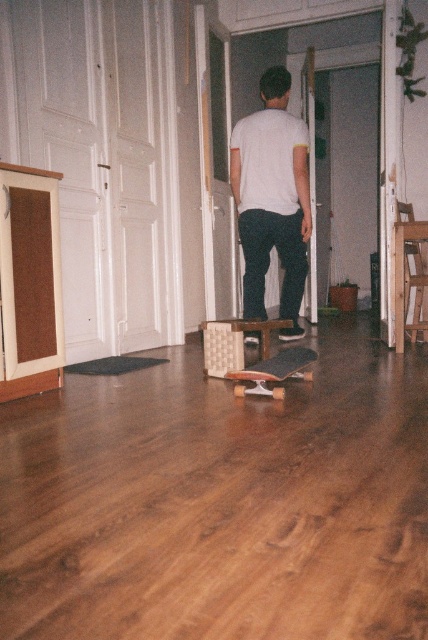
Question: Observing the image, what is the correct spatial positioning of white matte shirt at upper center in reference to wooden skateboard at center?

Choices:
 (A) left
 (B) right

Answer: (B)

Question: Which of the following is the closest to the observer?

Choices:
 (A) white matte shirt at upper center
 (B) wooden skateboard at center

Answer: (B)

Question: Which point appears farthest from the camera in this image?

Choices:
 (A) pos(256,257)
 (B) pos(249,381)

Answer: (A)

Question: Does white matte shirt at upper center have a larger size compared to wooden skateboard at center?

Choices:
 (A) no
 (B) yes

Answer: (B)

Question: From the image, what is the correct spatial relationship of white matte shirt at upper center in relation to wooden skateboard at center?

Choices:
 (A) above
 (B) below

Answer: (A)